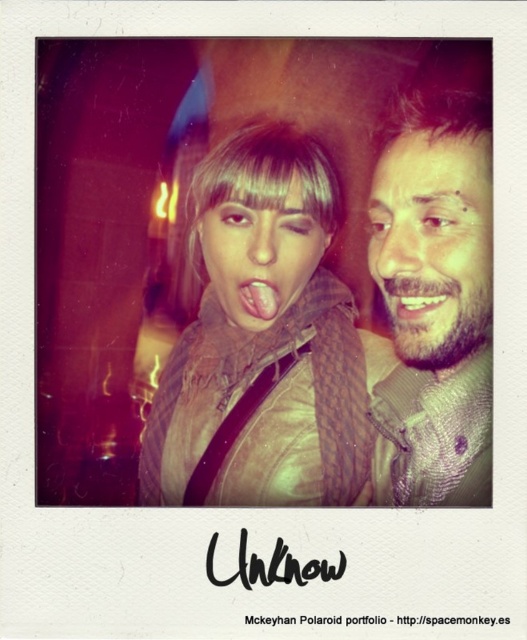
Where is `white glossy teeth at center`? The image size is (527, 640). white glossy teeth at center is located at coordinates (417, 300).

Does white glossy teeth at center have a lesser width compared to pink flesh-colored lips at center?

Correct, white glossy teeth at center's width is less than pink flesh-colored lips at center's.

Does point (401, 310) come behind point (266, 296)?

No.

Find the location of a particular element. white glossy teeth at center is located at coordinates (417, 300).

Does bearded man at upper right appear over matte skin face at center?

Incorrect, bearded man at upper right is not positioned above matte skin face at center.

Between bearded man at upper right and matte skin face at center, which one appears on the right side from the viewer's perspective?

Positioned to the right is bearded man at upper right.

Is point (392, 269) farther from viewer compared to point (328, 236)?

No.

The width and height of the screenshot is (527, 640). Identify the location of bearded man at upper right. (434, 243).

Is matte brown scarf at center to the left of bearded man at right from the viewer's perspective?

Yes, matte brown scarf at center is to the left of bearded man at right.

Where is `matte brown scarf at center`? matte brown scarf at center is located at coordinates (267, 340).

Does point (310, 284) come closer to viewer compared to point (442, 429)?

No.

I want to click on matte brown scarf at center, so click(x=267, y=340).